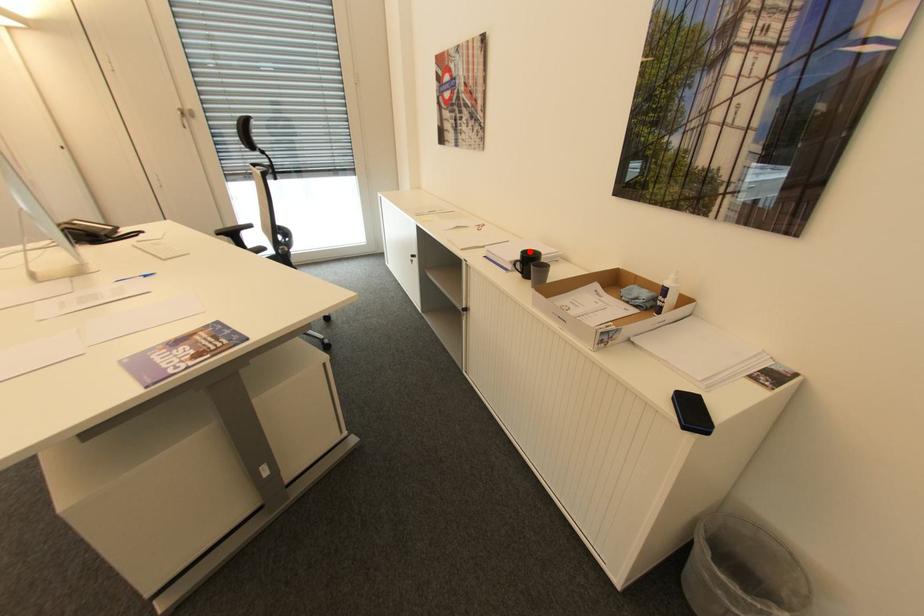
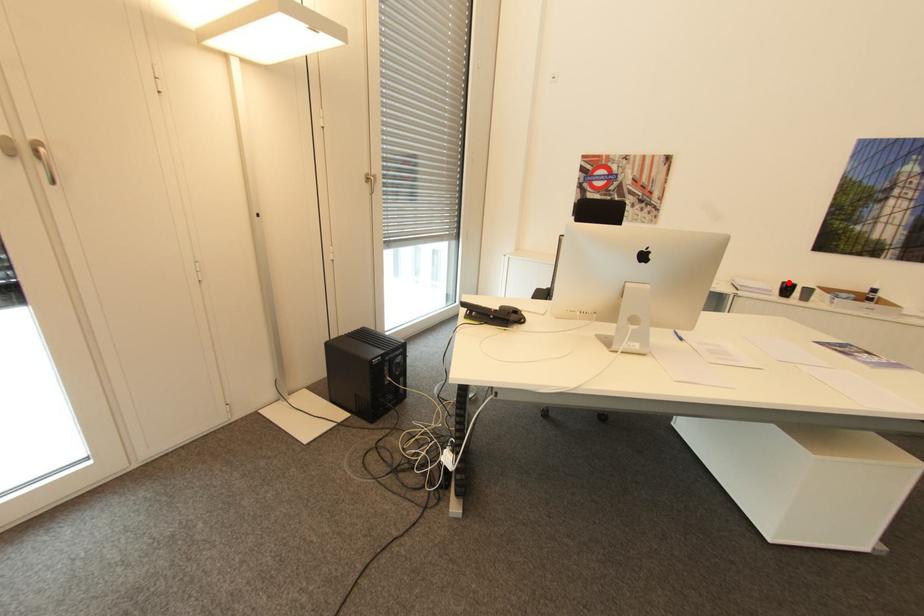
I am providing you with two images of the same scene from different viewpoints. A red point is marked on the first image and another point is marked on the second image. Does the point marked in image1 correspond to the same location as the one in image2?

Yes